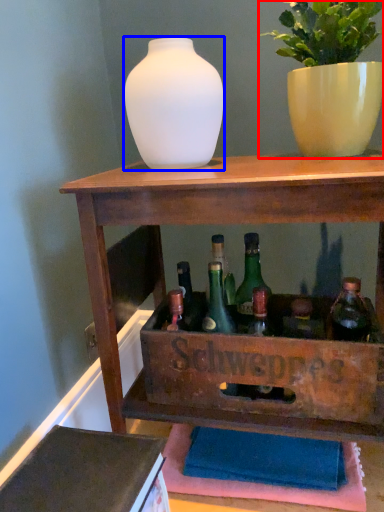
Question: Which object appears closest to the camera in this image, houseplant (highlighted by a red box) or vase (highlighted by a blue box)?

Choices:
 (A) houseplant
 (B) vase

Answer: (A)